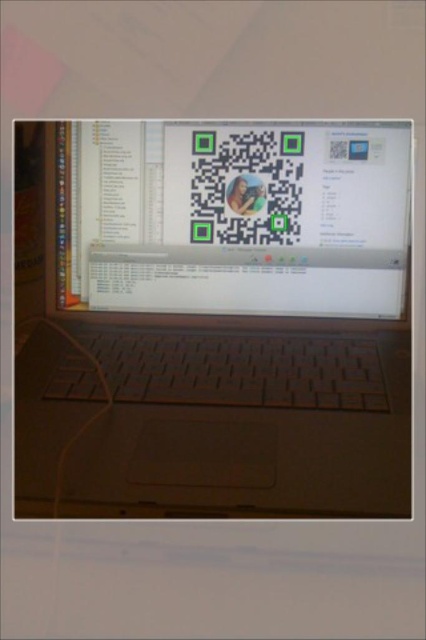
You need to place a sticker exactly in the middle of the satin silver laptop at center. Where would this sticker also be positioned relative to the white glossy qr code at center?

The sticker placed in the middle of the satin silver laptop at center would also be centered over the white glossy qr code at center since the laptop is larger but both are centered on the screen.

You are trying to scan the white glossy qr code at center using your phone camera. However, the satin silver laptop at center is blocking your view. Can you move the laptop to the side to get a clear scan?

The satin silver laptop at center is positioned under the white glossy qr code at center, so moving it to the side would allow you to scan the QR code without obstruction.

You are trying to locate a specific point on the laptop screen. According to the image, where exactly is the point labeled as point (213, 317) located?

The point (213, 317) is on the satin silver laptop at center.